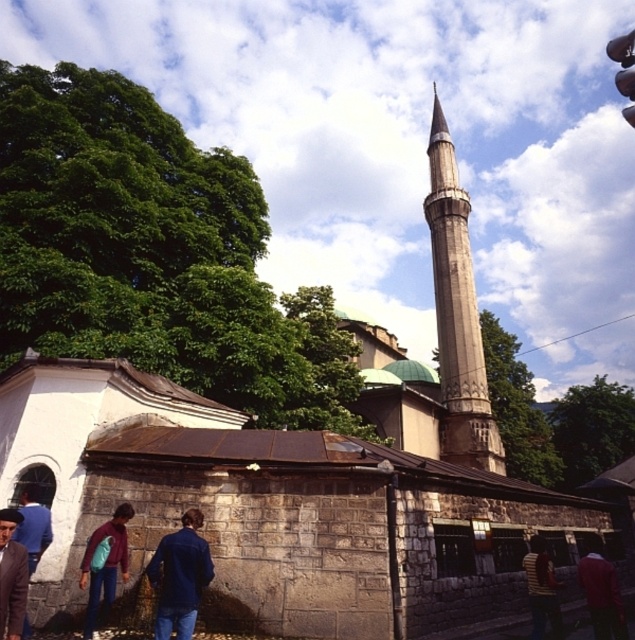
Can you confirm if denim jacket at lower left is wider than dark blue jacket at lower right?

No.

Is denim jacket at lower left taller than dark blue jacket at lower right?

Incorrect, denim jacket at lower left's height is not larger of dark blue jacket at lower right's.

Find the location of a particular element. The width and height of the screenshot is (635, 640). denim jacket at lower left is located at coordinates (104, 566).

Does smooth stone minaret at center lie behind denim jacket at lower left?

Yes, smooth stone minaret at center is behind denim jacket at lower left.

From the picture: Who is more distant from viewer, [490,412] or [123,557]?

The point [490,412] is more distant.

This screenshot has width=635, height=640. I want to click on smooth stone minaret at center, so click(x=457, y=314).

Does denim jacket at lower left have a lesser width compared to blue denim jacket at lower left?

Yes, denim jacket at lower left is thinner than blue denim jacket at lower left.

Does denim jacket at lower left appear on the left side of blue denim jacket at lower left?

In fact, denim jacket at lower left is to the right of blue denim jacket at lower left.

What do you see at coordinates (104, 566) in the screenshot?
I see `denim jacket at lower left` at bounding box center [104, 566].

Identify the location of denim jacket at lower left. The width and height of the screenshot is (635, 640). (104, 566).